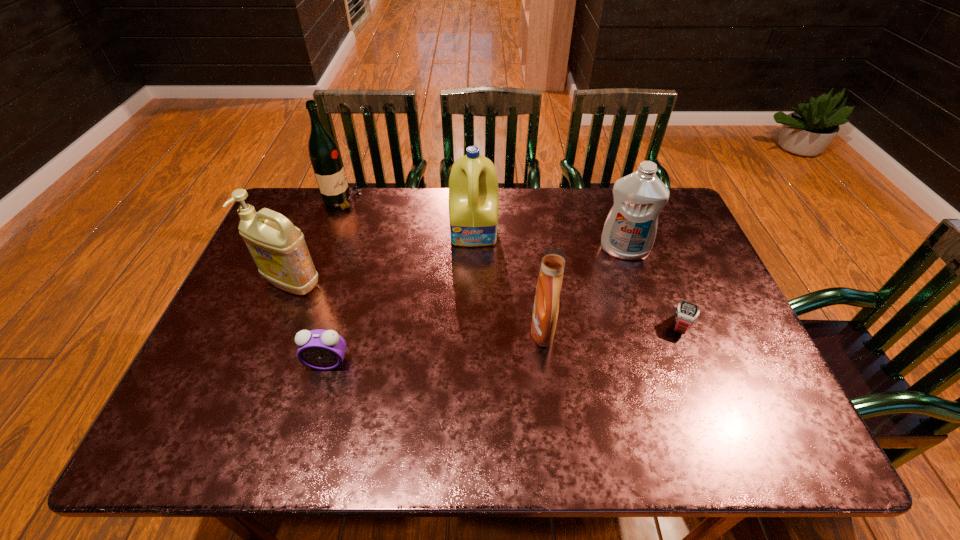
The image size is (960, 540). Find the location of `detergent located in the far edge section of the desktop`. detergent located in the far edge section of the desktop is located at coordinates [x=473, y=185].

At what (x,y) coordinates should I click in order to perform the action: click on wine bottle positioned at the left edge. Please return your answer as a coordinate pair (x, y). Looking at the image, I should click on (324, 154).

Find the location of a particular element. The height and width of the screenshot is (540, 960). detergent present at the left edge is located at coordinates (278, 248).

The image size is (960, 540). I want to click on detergent present at the right edge, so click(x=629, y=232).

I want to click on watch present at the right edge, so click(686, 313).

Find the location of a particular element. This screenshot has width=960, height=540. object located in the far left corner section of the desktop is located at coordinates (324, 154).

I want to click on free space at the far edge, so click(x=538, y=206).

Identify the location of free space at the near edge of the desktop. The image size is (960, 540). (697, 451).

In the image, there is a desktop. What are the coordinates of `vacant space at the left edge` in the screenshot? It's located at (215, 380).

I want to click on free space at the right edge of the desktop, so click(684, 284).